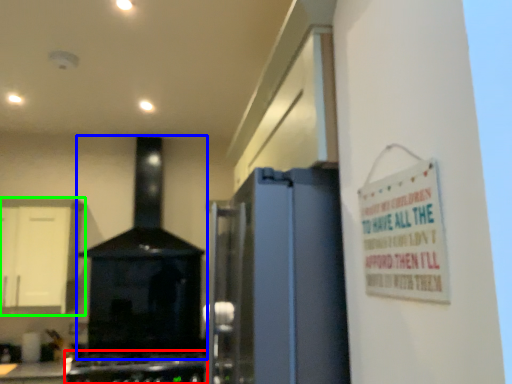
Question: Which object is positioned farthest from gas stove (highlighted by a red box)? Select from home appliance (highlighted by a blue box) and cabinetry (highlighted by a green box).

Choices:
 (A) home appliance
 (B) cabinetry

Answer: (B)